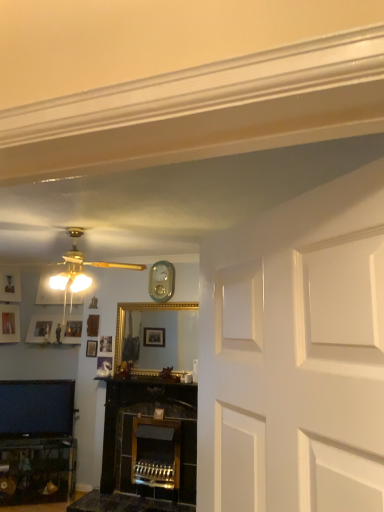
Question: Can you confirm if matte silver picture frame at upper left, which ranks as the 1th picture frame in back-to-front order, is smaller than matte gold ceiling fan at upper left?

Choices:
 (A) yes
 (B) no

Answer: (B)

Question: Is matte silver picture frame at upper left, acting as the 2th picture frame starting from the right, further to camera compared to matte gold ceiling fan at upper left?

Choices:
 (A) no
 (B) yes

Answer: (B)

Question: Would you say matte silver picture frame at upper left, acting as the second picture frame starting from the left, is outside matte gold ceiling fan at upper left?

Choices:
 (A) no
 (B) yes

Answer: (B)

Question: From the image's perspective, is matte silver picture frame at upper left, which ranks as the 1th picture frame in back-to-front order, below matte gold ceiling fan at upper left?

Choices:
 (A) yes
 (B) no

Answer: (A)

Question: Can you confirm if matte silver picture frame at upper left, acting as the second picture frame starting from the left, is positioned to the left of matte gold ceiling fan at upper left?

Choices:
 (A) yes
 (B) no

Answer: (A)

Question: Is matte silver picture frame at upper left, acting as the second picture frame starting from the left, aimed at matte gold ceiling fan at upper left?

Choices:
 (A) no
 (B) yes

Answer: (A)

Question: Does wooden picture frame at upper left, marked as the third picture frame in a left-to-right arrangement, have a greater width compared to matte silver picture frame at left, the 3th picture frame positioned from the right?

Choices:
 (A) no
 (B) yes

Answer: (A)

Question: Is the depth of wooden picture frame at upper left, which appears as the first picture frame when viewed from the right, less than that of matte silver picture frame at left, placed as the 1th picture frame when sorted from left to right?

Choices:
 (A) no
 (B) yes

Answer: (B)

Question: Can you confirm if wooden picture frame at upper left, the first picture frame viewed from the front, is bigger than matte silver picture frame at left, arranged as the second picture frame when viewed from the back?

Choices:
 (A) yes
 (B) no

Answer: (B)

Question: Is wooden picture frame at upper left, marked as the third picture frame in a left-to-right arrangement, touching matte silver picture frame at left, the 2th picture frame when ordered from front to back?

Choices:
 (A) no
 (B) yes

Answer: (A)

Question: Can you confirm if wooden picture frame at upper left, which appears as the first picture frame when viewed from the right, is positioned to the left of matte silver picture frame at left, arranged as the second picture frame when viewed from the back?

Choices:
 (A) no
 (B) yes

Answer: (A)

Question: Is wooden picture frame at upper left, the 3th picture frame viewed from the back, at the right side of matte silver picture frame at left, the 3th picture frame positioned from the right?

Choices:
 (A) yes
 (B) no

Answer: (A)

Question: From a real-world perspective, is matte silver picture frame at left, placed as the 1th picture frame when sorted from left to right, under matte black tv at lower left?

Choices:
 (A) yes
 (B) no

Answer: (B)